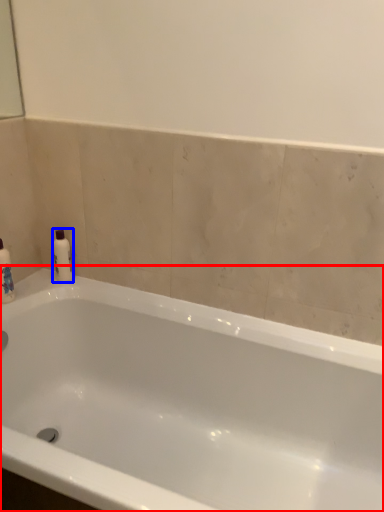
Question: Which object is further to the camera taking this photo, bathtub (highlighted by a red box) or mouthwash (highlighted by a blue box)?

Choices:
 (A) bathtub
 (B) mouthwash

Answer: (B)